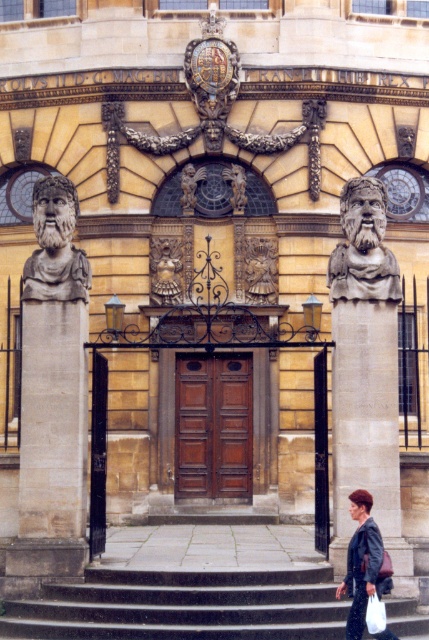
Question: Among these objects, which one is farthest from the camera?

Choices:
 (A) gold metallic statue at center
 (B) dark gray stone stairs at center
 (C) gray stone bust at right

Answer: (A)

Question: Considering the relative positions of dark gray leather jacket at lower right and polished bronze cherub at center in the image provided, where is dark gray leather jacket at lower right located with respect to polished bronze cherub at center?

Choices:
 (A) below
 (B) above

Answer: (A)

Question: Does polished bronze statue at center appear on the right side of golden stone lion at center?

Choices:
 (A) yes
 (B) no

Answer: (A)

Question: Which is nearer to the polished bronze statue at center?

Choices:
 (A) white plastic bag at lower right
 (B) dark gray leather jacket at lower right
 (C) polished stone bust at left
 (D) gold metallic statue at center

Answer: (D)

Question: Is polished stone bust at left closer to camera compared to polished bronze cherub at center?

Choices:
 (A) yes
 (B) no

Answer: (A)

Question: Which of the following is the farthest from the observer?

Choices:
 (A) (38, 228)
 (B) (148, 627)
 (C) (232, 164)
 (D) (372, 595)

Answer: (C)